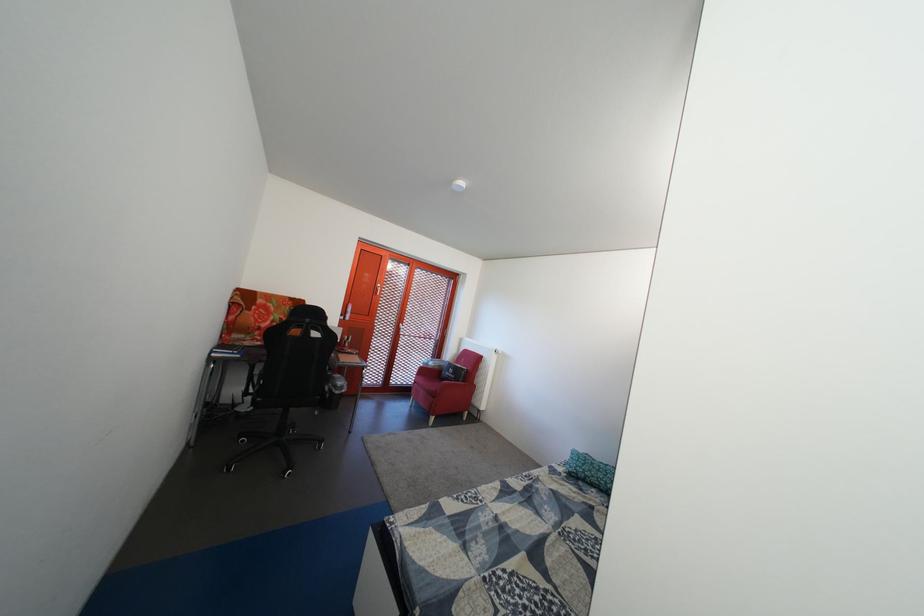
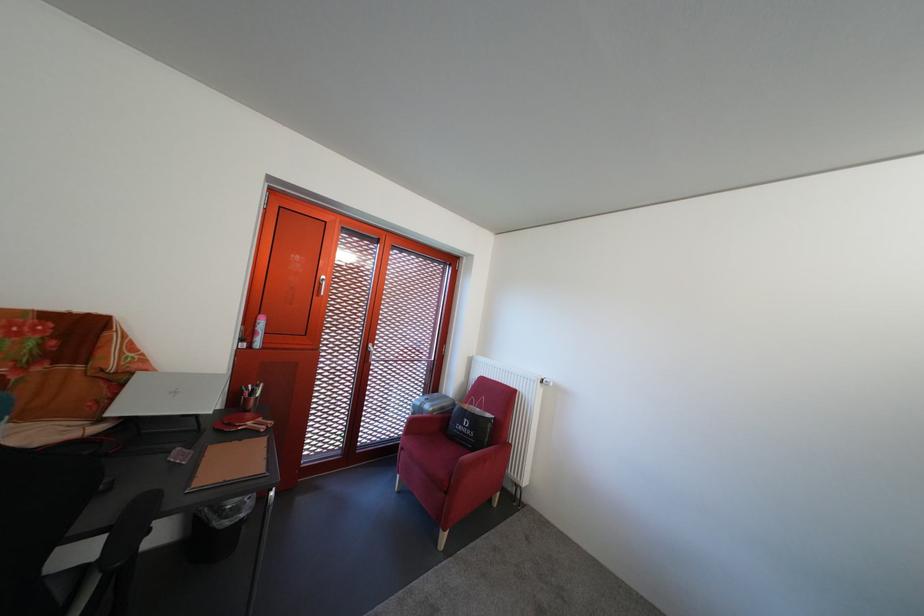
Question: The images are taken continuously from a first-person perspective. In which direction are you moving?

Choices:
 (A) Left
 (B) Right
 (C) Forward
 (D) Backward

Answer: (C)